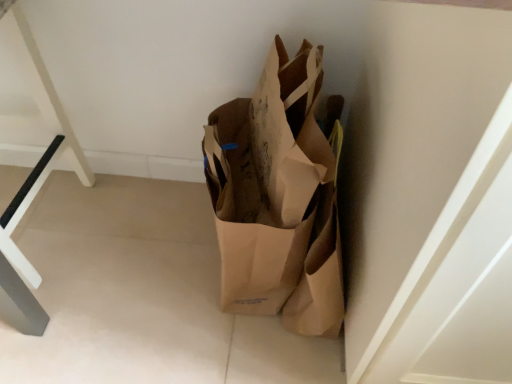
Where is `vacant space to the right of white plastic table at left`? vacant space to the right of white plastic table at left is located at coordinates (139, 248).